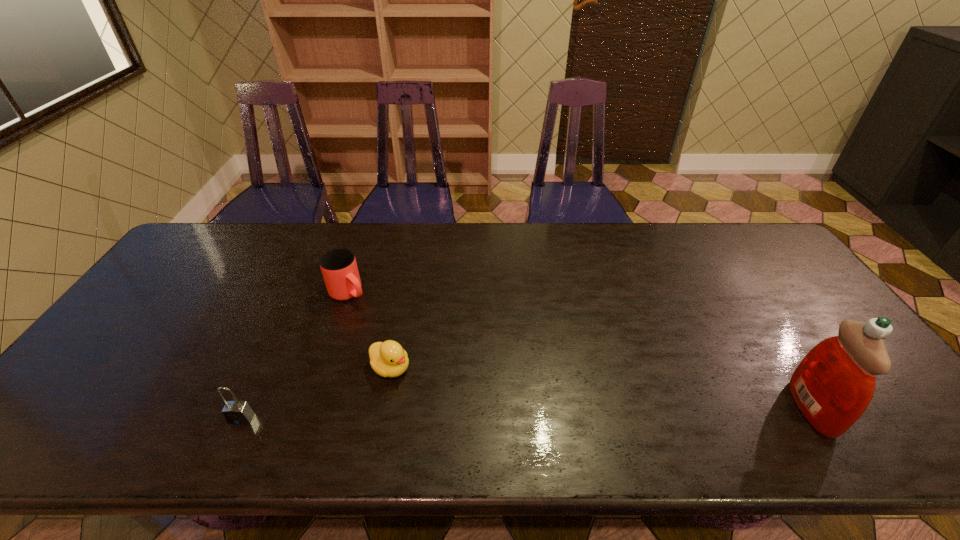
You are a GUI agent. You are given a task and a screenshot of the screen. Output one action in this format:
    pyautogui.click(x=<x>, y=<y>)
    Task: Click on the blank space located on the handle side of the cup
    The width and height of the screenshot is (960, 540).
    Given the screenshot: What is the action you would take?
    coord(444,373)

Where is `vacant region located 0.170m on the beak of the shortest object`? vacant region located 0.170m on the beak of the shortest object is located at coordinates (459, 414).

The width and height of the screenshot is (960, 540). I want to click on vacant space situated 0.070m on the beak of the shortest object, so click(426, 392).

Find the location of `free space located on the beak of the shortest object`. free space located on the beak of the shortest object is located at coordinates (436, 398).

Find the location of `padlock that is at the near edge`. padlock that is at the near edge is located at coordinates (236, 412).

Identify the location of detergent present at the near edge. (833, 385).

This screenshot has width=960, height=540. What are the coordinates of `duckling positioned at the near edge` in the screenshot? It's located at (388, 359).

Image resolution: width=960 pixels, height=540 pixels. In the image, there is a desktop. What are the coordinates of `vacant area at the far edge` in the screenshot? It's located at (634, 229).

In the image, there is a desktop. Where is `free space at the near edge`? This screenshot has width=960, height=540. free space at the near edge is located at coordinates (166, 390).

Locate an element on the screen. This screenshot has height=540, width=960. blank space at the right edge of the desktop is located at coordinates (825, 310).